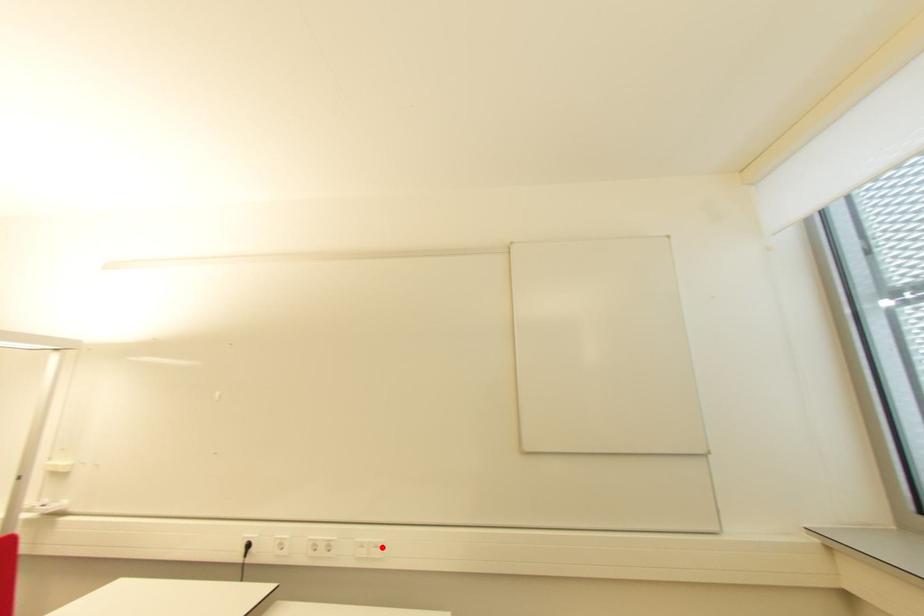
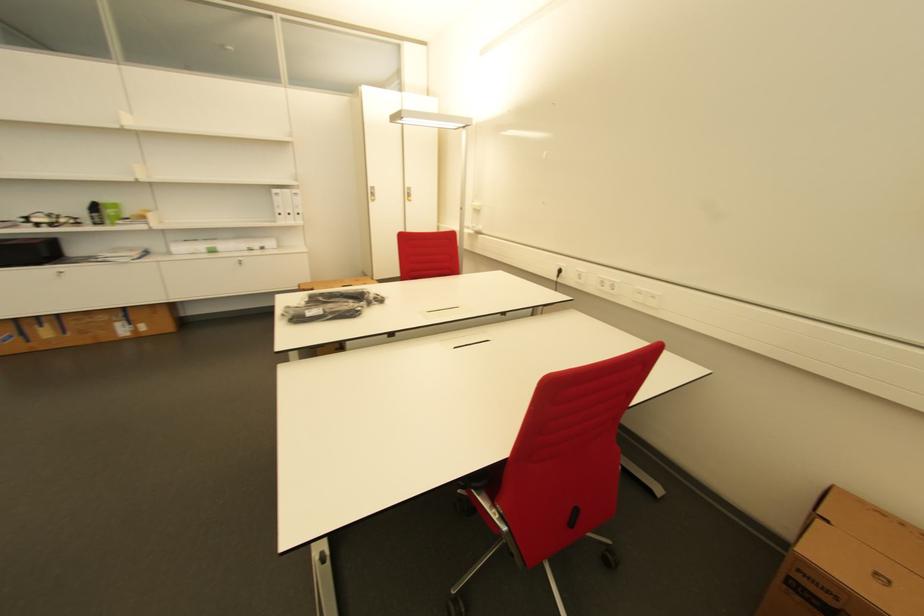
Locate, in the second image, the point that corresponds to the highlighted location in the first image.

(659, 299)